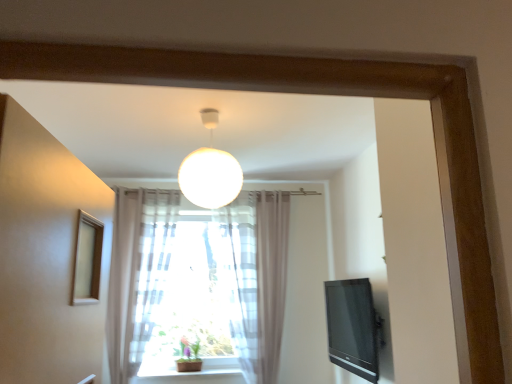
Question: Is green matte plant at center positioned beyond the bounds of black glossy tv at right?

Choices:
 (A) no
 (B) yes

Answer: (B)

Question: Is green matte plant at center surrounding black glossy tv at right?

Choices:
 (A) yes
 (B) no

Answer: (B)

Question: Does green matte plant at center have a greater width compared to black glossy tv at right?

Choices:
 (A) yes
 (B) no

Answer: (A)

Question: From the image's perspective, is green matte plant at center on top of black glossy tv at right?

Choices:
 (A) yes
 (B) no

Answer: (B)

Question: Is green matte plant at center to the right of black glossy tv at right from the viewer's perspective?

Choices:
 (A) no
 (B) yes

Answer: (A)

Question: Considering the positions of white matte sphere at center and green matte plant at center in the image, is white matte sphere at center wider or thinner than green matte plant at center?

Choices:
 (A) thin
 (B) wide

Answer: (B)

Question: From a real-world perspective, is white matte sphere at center physically located above or below green matte plant at center?

Choices:
 (A) below
 (B) above

Answer: (B)

Question: Considering their positions, is white matte sphere at center located in front of or behind green matte plant at center?

Choices:
 (A) behind
 (B) front

Answer: (B)

Question: Is white matte sphere at center inside or outside of green matte plant at center?

Choices:
 (A) inside
 (B) outside

Answer: (B)

Question: Is point (364, 334) positioned closer to the camera than point (123, 258)?

Choices:
 (A) farther
 (B) closer

Answer: (B)

Question: From a real-world perspective, relative to translucent fabric curtain at lower center, is black glossy tv at right vertically above or below?

Choices:
 (A) above
 (B) below

Answer: (B)

Question: Would you say black glossy tv at right is to the left or to the right of translucent fabric curtain at lower center in the picture?

Choices:
 (A) left
 (B) right

Answer: (B)

Question: Is black glossy tv at right bigger or smaller than translucent fabric curtain at lower center?

Choices:
 (A) small
 (B) big

Answer: (A)

Question: Does point (226, 198) appear closer or farther from the camera than point (357, 370)?

Choices:
 (A) closer
 (B) farther

Answer: (A)

Question: In terms of height, does white matte sphere at center look taller or shorter compared to black glossy tv at right?

Choices:
 (A) tall
 (B) short

Answer: (A)